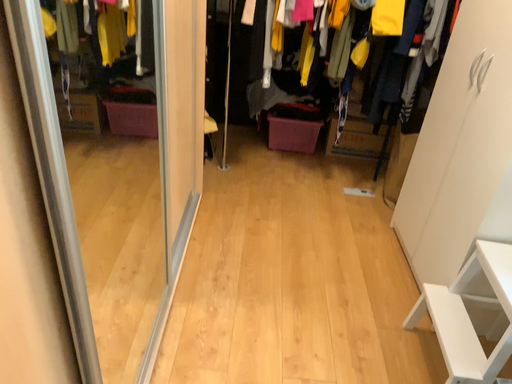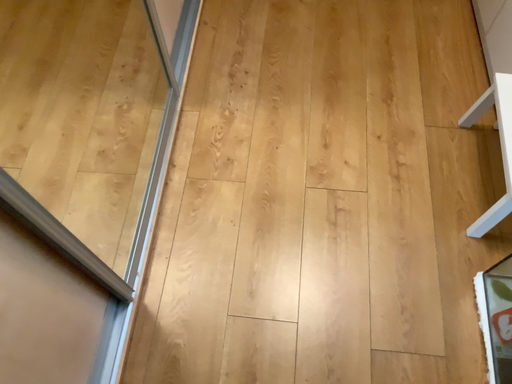
Question: How did the camera likely rotate when shooting the video?

Choices:
 (A) rotated upward
 (B) rotated downward

Answer: (B)